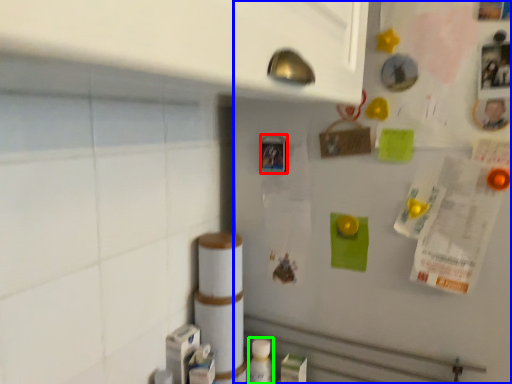
Question: Considering the real-world distances, which object is farthest from button (highlighted by a red box)? fridge (highlighted by a blue box) or bottle (highlighted by a green box)?

Choices:
 (A) fridge
 (B) bottle

Answer: (B)